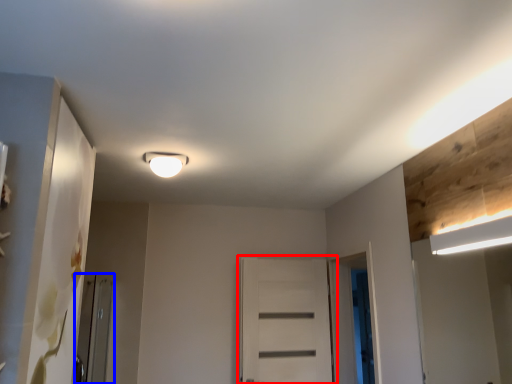
Question: Which object is further to the camera taking this photo, door (highlighted by a red box) or screen door (highlighted by a blue box)?

Choices:
 (A) door
 (B) screen door

Answer: (A)